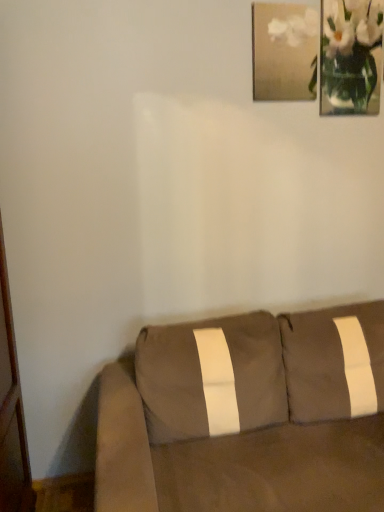
Question: Is matte gold picture frame at upper right with suede brown couch at lower right?

Choices:
 (A) yes
 (B) no

Answer: (B)

Question: Can you confirm if matte gold picture frame at upper right is taller than suede brown couch at lower right?

Choices:
 (A) yes
 (B) no

Answer: (B)

Question: From the image's perspective, is matte gold picture frame at upper right on top of suede brown couch at lower right?

Choices:
 (A) yes
 (B) no

Answer: (A)

Question: Is matte gold picture frame at upper right bigger than suede brown couch at lower right?

Choices:
 (A) no
 (B) yes

Answer: (A)

Question: Is matte gold picture frame at upper right oriented away from suede brown couch at lower right?

Choices:
 (A) yes
 (B) no

Answer: (B)

Question: Is matte gold picture frame at upper right to the right of suede brown couch at lower right from the viewer's perspective?

Choices:
 (A) no
 (B) yes

Answer: (B)

Question: From a real-world perspective, is white glass vase at upper right physically above suede brown couch at lower right?

Choices:
 (A) no
 (B) yes

Answer: (B)

Question: Is white glass vase at upper right next to suede brown couch at lower right?

Choices:
 (A) no
 (B) yes

Answer: (A)

Question: From the image's perspective, is white glass vase at upper right below suede brown couch at lower right?

Choices:
 (A) yes
 (B) no

Answer: (B)

Question: Is suede brown couch at lower right located within white glass vase at upper right?

Choices:
 (A) no
 (B) yes

Answer: (A)

Question: From a real-world perspective, is white glass vase at upper right beneath suede brown couch at lower right?

Choices:
 (A) no
 (B) yes

Answer: (A)

Question: Is white glass vase at upper right far away from suede brown couch at lower right?

Choices:
 (A) no
 (B) yes

Answer: (B)

Question: Is white glass vase at upper right closer to camera compared to matte gold picture frame at upper right?

Choices:
 (A) no
 (B) yes

Answer: (A)